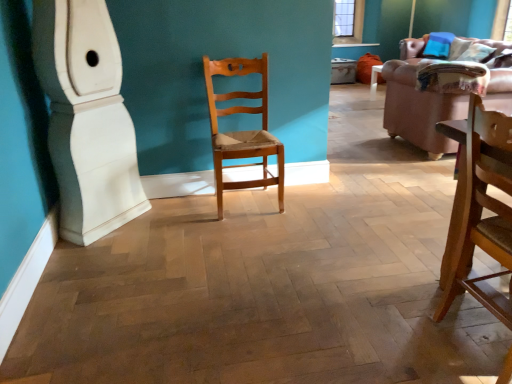
Question: Is brown leather couch at upper right taller or shorter than velvet pink couch at right?

Choices:
 (A) short
 (B) tall

Answer: (A)

Question: Is brown leather couch at upper right in front of or behind velvet pink couch at right in the image?

Choices:
 (A) front
 (B) behind

Answer: (B)

Question: Estimate the real-world distances between objects in this image. Which object is closer to the light brown wood chair at center, which ranks as the 1th chair in left-to-right order?

Choices:
 (A) velvet pink couch at right
 (B) wooden chair at right, marked as the second chair in a left-to-right arrangement
 (C) brown leather couch at upper right

Answer: (B)

Question: Which object is positioned farthest from the wooden chair at right, positioned as the 1th chair in front-to-back order?

Choices:
 (A) brown leather couch at upper right
 (B) velvet pink couch at right
 (C) light brown wood chair at center, which ranks as the 1th chair in left-to-right order

Answer: (A)